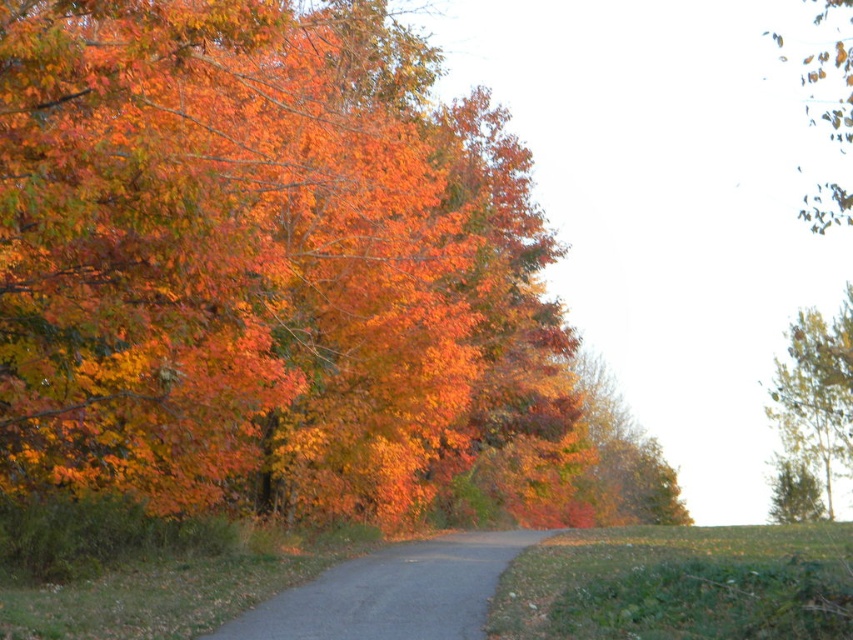
You are driving a car that is 2 meters wide. You need to navigate through the gray asphalt road at center while avoiding the orange matte tree at center. Can your car safely pass through the road without hitting the tree?

The gray asphalt road at center has a lesser width compared to orange matte tree at center. Since the road is narrower than the tree, it might not be wide enough for a 2m car to pass safely. Check the actual width before proceeding.

You are a hiker walking along the winding dirt road in the autumn forest. You notice shiny orange leaves at left and an orange matte tree at center. Which object is located to the left of the other?

The shiny orange leaves at left is positioned on the left side of orange matte tree at center.

You are standing on the winding dirt road in the autumn forest. You see two points marked on the road ahead of you. The first point is at coordinates point (770, 387) and the second is at point (587, 412). Which point is closer to you as you walk along the road?

Point (770, 387) is further to the viewer than point (587, 412), so the closer point to you is point (587, 412).